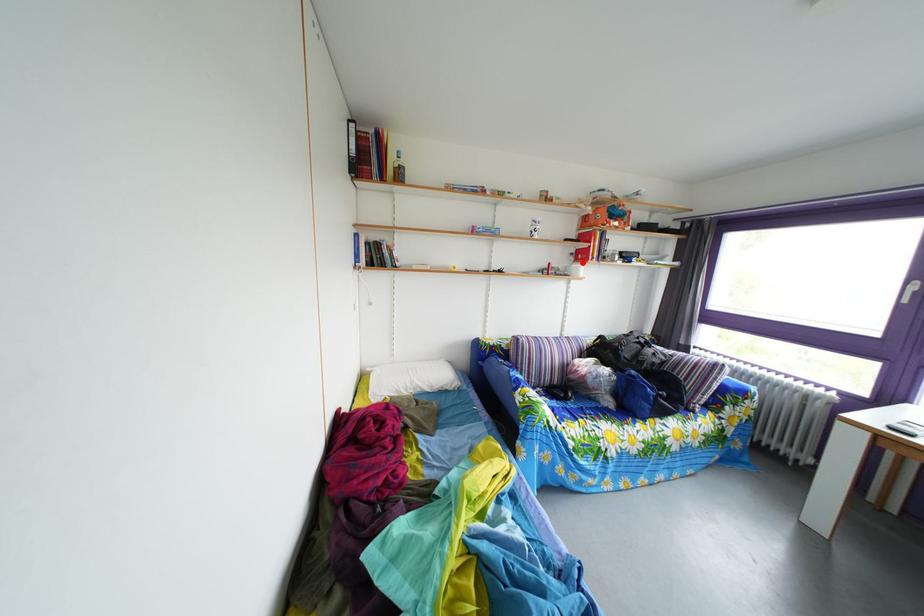
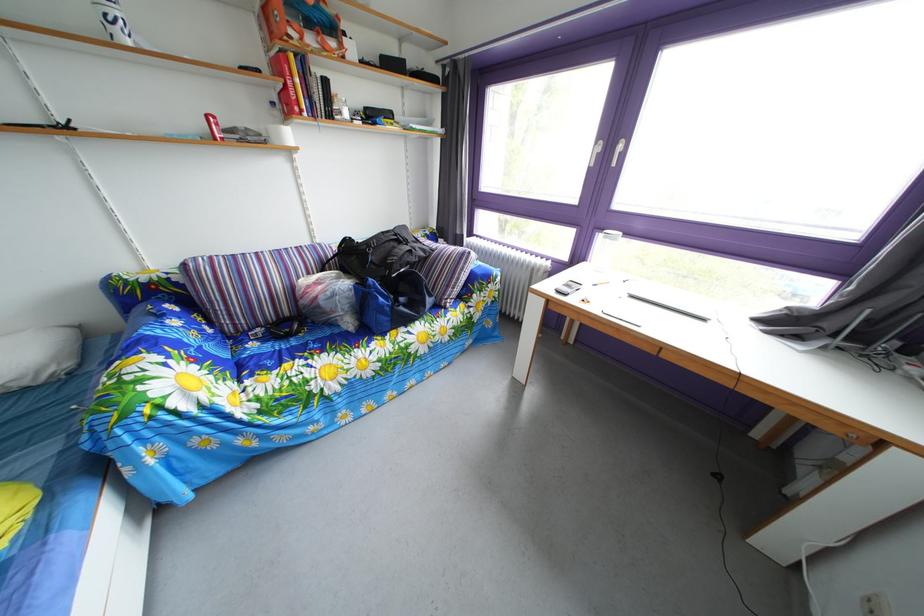
In the second image, find the point that corresponds to the highlighted location in the first image.

(284, 111)